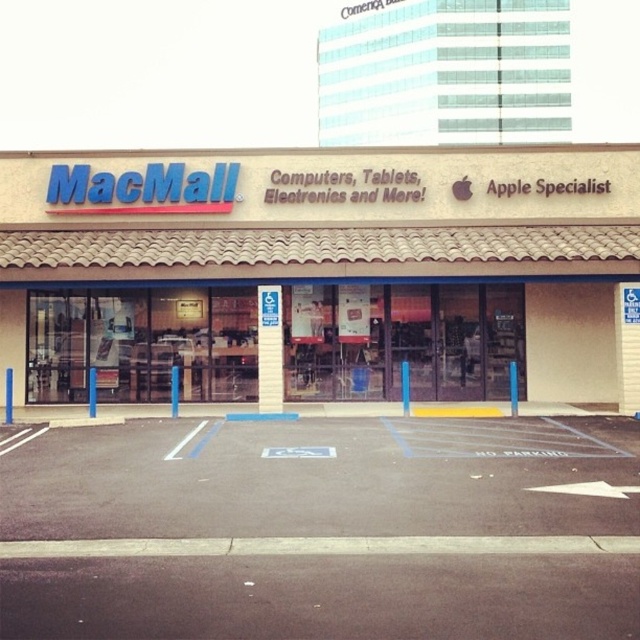
Is point (330, 204) positioned after point (192, 492)?

Yes, point (330, 204) is farther from viewer.

Who is positioned more to the right, beige tile macmall at center or black asphalt parking lot at lower center?

black asphalt parking lot at lower center is more to the right.

Between point (307, 291) and point (509, 436), which one is positioned in front?

Positioned in front is point (509, 436).

I want to click on beige tile macmall at center, so click(x=323, y=273).